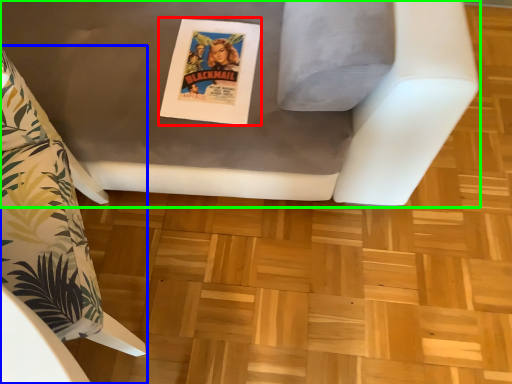
Question: Which is nearer to the comic book (highlighted by a red box)? furniture (highlighted by a blue box) or furniture (highlighted by a green box).

Choices:
 (A) furniture
 (B) furniture

Answer: (B)